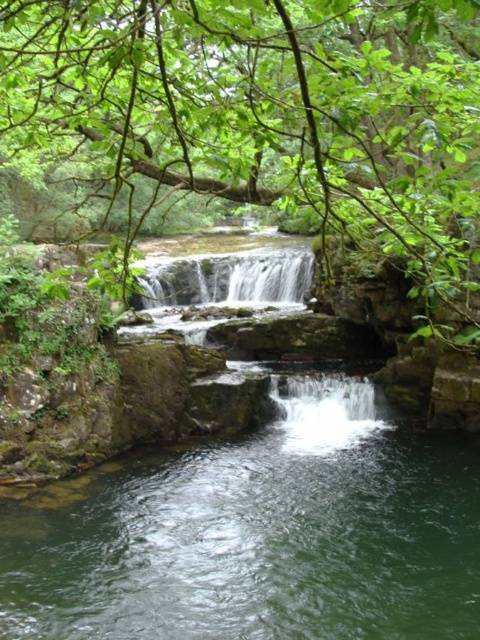
Is point (256, 568) closer to camera compared to point (320, 134)?

No, it is behind (320, 134).

Can you confirm if clear water at center is positioned above green leafy tree at center?

Actually, clear water at center is below green leafy tree at center.

Is point (170, 564) farther from viewer compared to point (440, 179)?

Yes, point (170, 564) is farther from viewer.

Locate an element on the screen. Image resolution: width=480 pixels, height=640 pixels. clear water at center is located at coordinates (262, 534).

Between green leafy tree at center and white smooth waterfall at center, which one has less height?

Standing shorter between the two is white smooth waterfall at center.

Between green leafy tree at center and white smooth waterfall at center, which one is positioned higher?

green leafy tree at center is above.

I want to click on green leafy tree at center, so click(265, 115).

Between clear water at center and white smooth waterfall at center, which one has more height?

clear water at center

Does point (245, 465) come closer to viewer compared to point (193, 275)?

Yes, point (245, 465) is in front of point (193, 275).

Is point (467, 586) in front of point (200, 260)?

Yes, point (467, 586) is in front of point (200, 260).

What are the coordinates of `clear water at center` in the screenshot? It's located at (262, 534).